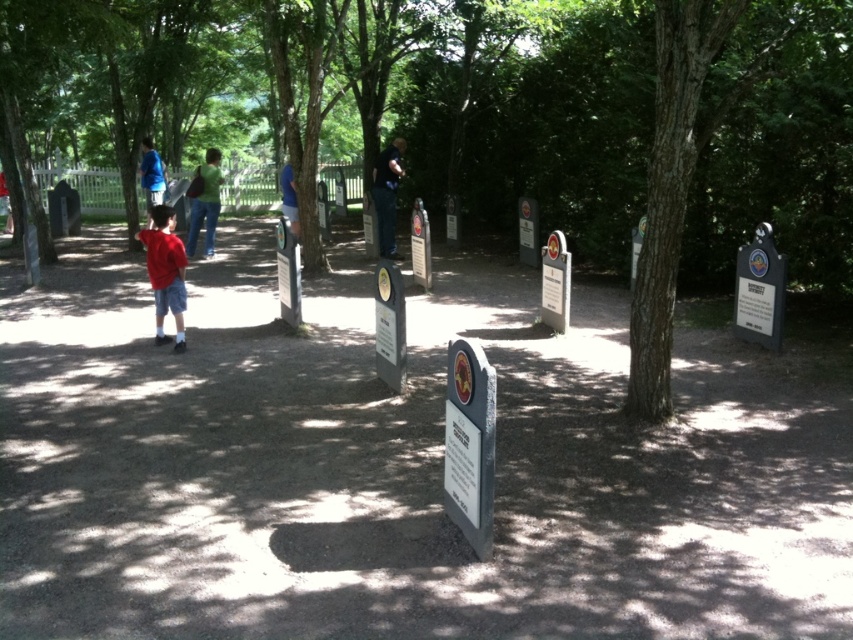
You are standing at the entrance of the park and see two points marked on the ground. The first point is located at coordinates point (477, 320) and the second point is at point (209, 218). Which point is closer to you?

Point (477, 320) is closer to the viewer than point (209, 218).

You are standing at the viewpoint looking at the markers. There are two points marked on the ground in the image. Which point is closer to you, point [643,371] or point [289,216]?

Point [643,371] is closer to the viewer than point [289,216].